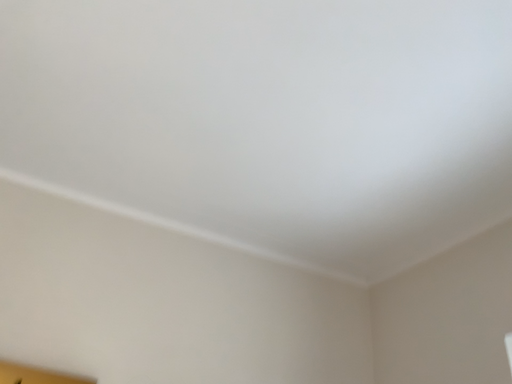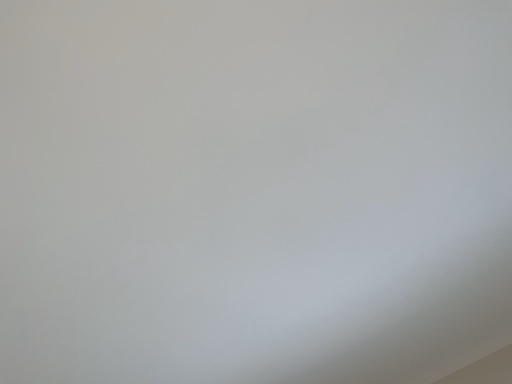
Question: How did the camera likely rotate when shooting the video?

Choices:
 (A) rotated right
 (B) rotated left

Answer: (A)